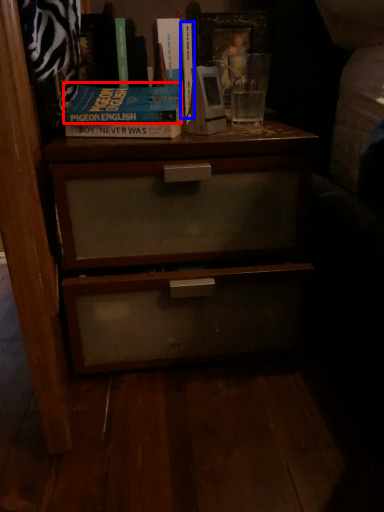
Question: Which object is closer to the camera taking this photo, paperback book (highlighted by a red box) or book (highlighted by a blue box)?

Choices:
 (A) paperback book
 (B) book

Answer: (A)